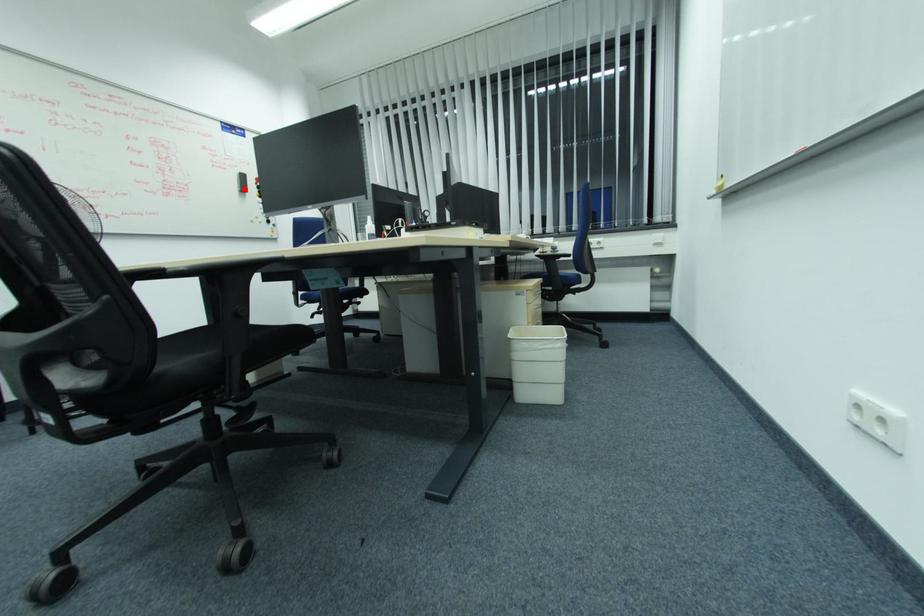
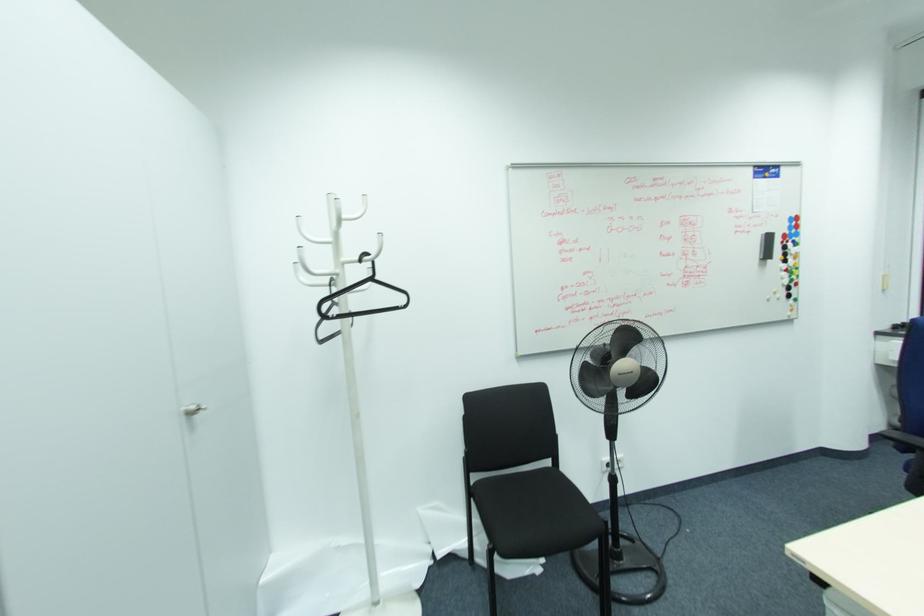
Where in the second image is the point corresponding to the highlighted location from the first image?

(768, 256)